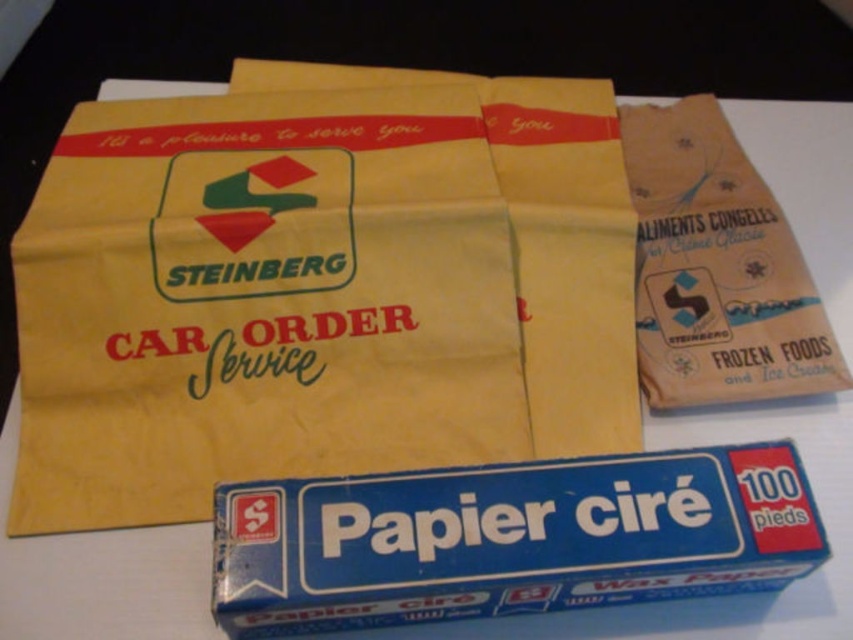
Question: Does blue paper wax paper at lower center come in front of brown paper bag at upper right?

Choices:
 (A) yes
 (B) no

Answer: (A)

Question: Which of these objects is positioned closest to the yellow paper bag at upper center?

Choices:
 (A) brown paper bag at upper right
 (B) blue paper wax paper at lower center

Answer: (B)

Question: Based on their relative distances, which object is farther from the blue paper wax paper at lower center?

Choices:
 (A) brown paper bag at upper right
 (B) yellow paper bag at upper center

Answer: (A)

Question: Where is blue paper wax paper at lower center located in relation to brown paper bag at upper right in the image?

Choices:
 (A) above
 (B) below

Answer: (B)

Question: Can you confirm if yellow paper bag at upper center is positioned above blue paper wax paper at lower center?

Choices:
 (A) no
 (B) yes

Answer: (B)

Question: Which of the following is the farthest from the observer?

Choices:
 (A) yellow paper bag at upper center
 (B) blue paper wax paper at lower center

Answer: (A)